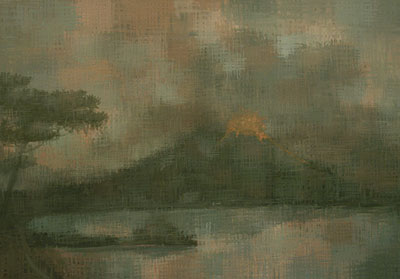
The image size is (400, 279). What are the coordinates of `shade` in the screenshot? It's located at (49, 177).